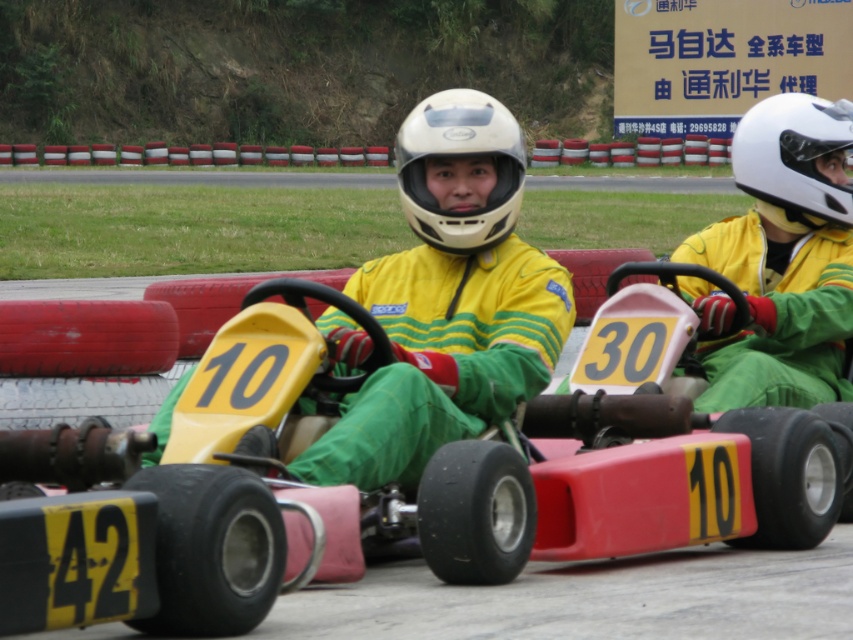
Does matte yellow/green racing suit at center have a greater height compared to matte white helmet at center?

Yes.

Is matte yellow/green racing suit at center positioned behind matte white helmet at center?

No, matte yellow/green racing suit at center is in front of matte white helmet at center.

This screenshot has width=853, height=640. I want to click on matte yellow/green racing suit at center, so click(450, 300).

Who is higher up, yellow matte race car at center or matte yellow/green racing suit at center?

Positioned higher is matte yellow/green racing suit at center.

This screenshot has width=853, height=640. Describe the element at coordinates (381, 490) in the screenshot. I see `yellow matte race car at center` at that location.

The height and width of the screenshot is (640, 853). I want to click on yellow matte race car at center, so click(x=381, y=490).

Between yellow/green fabric suit at center and matte white helmet at center, which one has less height?

Standing shorter between the two is yellow/green fabric suit at center.

Which is in front, point (744, 218) or point (401, 205)?

Point (744, 218)

What do you see at coordinates (781, 259) in the screenshot? Image resolution: width=853 pixels, height=640 pixels. I see `yellow/green fabric suit at center` at bounding box center [781, 259].

The image size is (853, 640). In order to click on yellow/green fabric suit at center in this screenshot , I will do `click(781, 259)`.